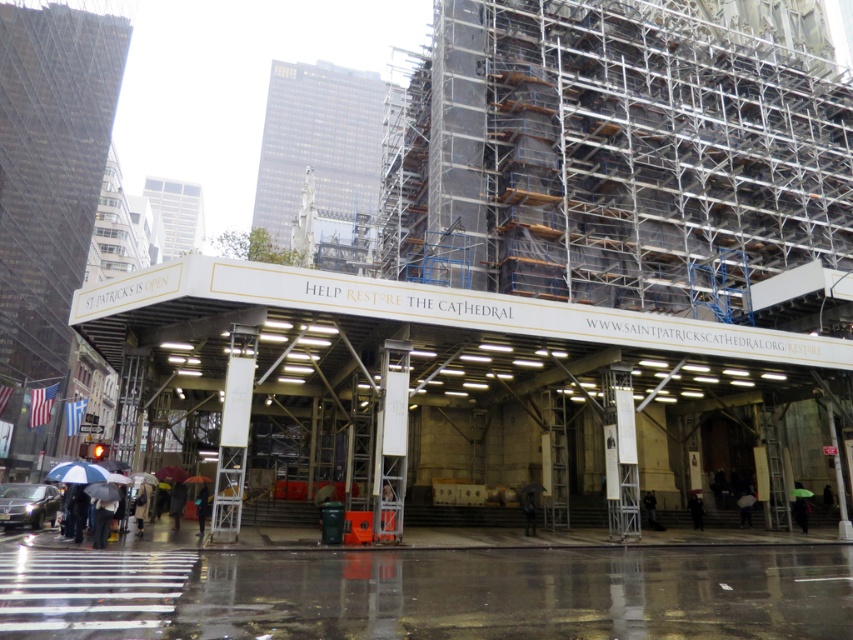
Does white concrete parking garage at center have a lesser height compared to raincoat matte at lower left?

In fact, white concrete parking garage at center may be taller than raincoat matte at lower left.

Identify the location of white concrete parking garage at center. (437, 356).

Is raincoat matte at lower left wider than dark gray jacket at center?

Yes.

From the picture: Who is more forward, [140,529] or [642,500]?

Positioned in front is point [140,529].

Between point (184, 484) and point (654, 522), which one is positioned behind?

Point (654, 522)

In order to click on raincoat matte at lower left in this screenshot , I will do `click(173, 490)`.

Can you confirm if shiny black sedan at lower left is taller than dark gray jacket at center?

No.

Which is behind, point (15, 525) or point (659, 524)?

The point (659, 524) is behind.

Is point (3, 502) positioned in front of point (653, 516)?

Yes, point (3, 502) is in front of point (653, 516).

I want to click on shiny black sedan at lower left, so click(28, 506).